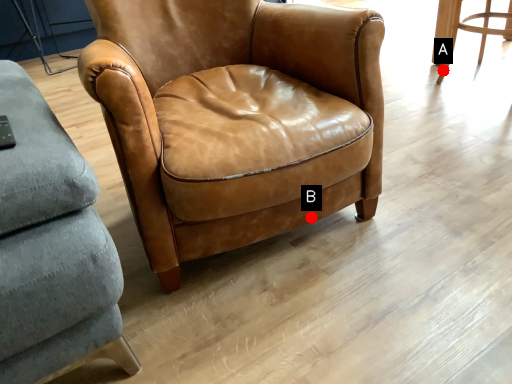
Question: Two points are circled on the image, labeled by A and B beside each circle. Which of the following is the farthest from the observer?

Choices:
 (A) A is further
 (B) B is further

Answer: (A)